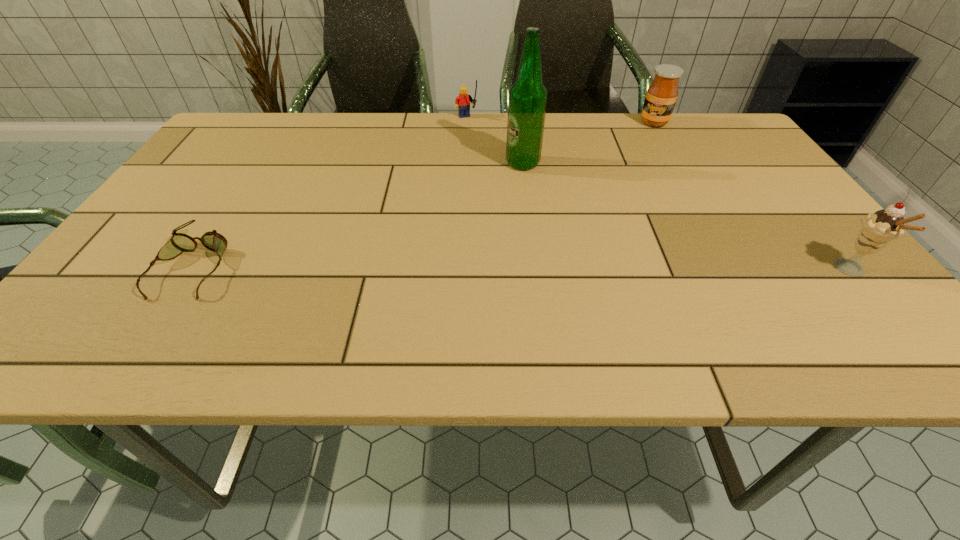
The height and width of the screenshot is (540, 960). I want to click on free space on the desktop that is between the leftmost object and the icecream and is positioned on the label of the tallest object, so click(x=452, y=267).

In order to click on vacant space on the desktop that is between the shortest object and the icecream and is positioned on the front-facing side of the fourth object from right to left in this screenshot , I will do `click(551, 268)`.

At what (x,y) coordinates should I click in order to perform the action: click on free space on the desktop that is between the leftmost object and the rightmost object and is positioned on the front-facing side of the fourth object from left to right. Please return your answer as a coordinate pair (x, y). The image size is (960, 540). Looking at the image, I should click on (613, 269).